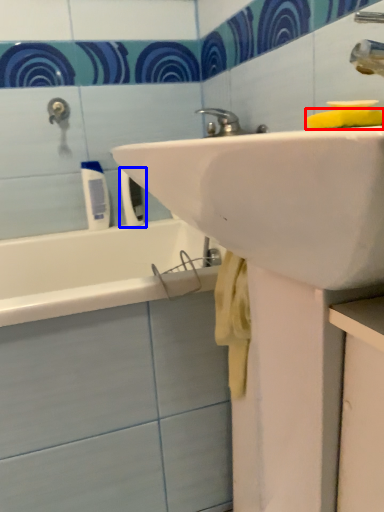
Question: Which object appears closest to the camera in this image, soap (highlighted by a red box) or toiletry (highlighted by a blue box)?

Choices:
 (A) soap
 (B) toiletry

Answer: (A)